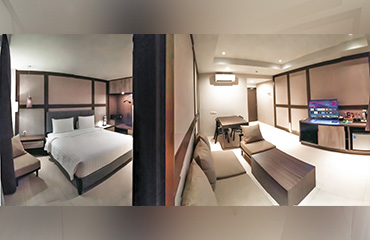
Where is `door`? The height and width of the screenshot is (240, 370). door is located at coordinates (252, 97).